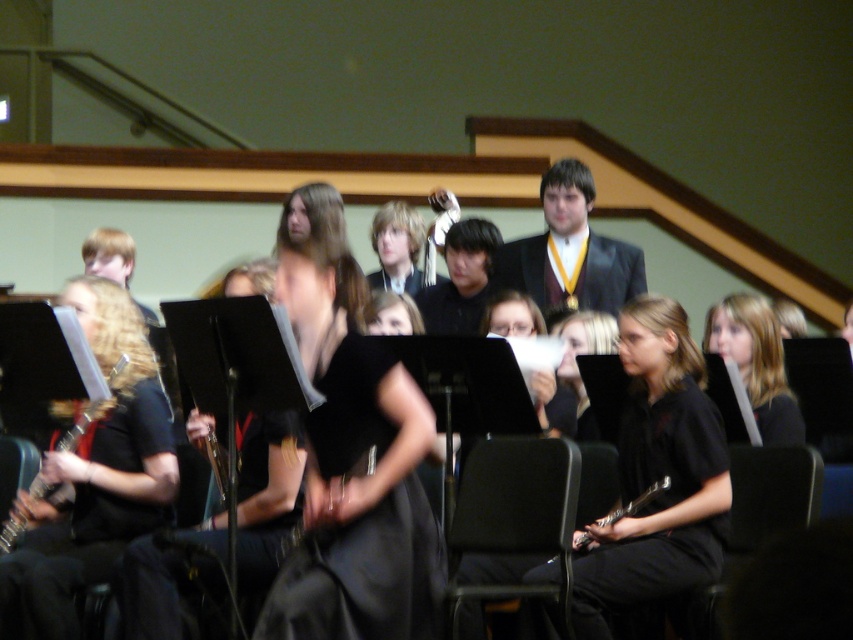
You are a photographer setting up for a school band photo. You need to position a light source between the black fabric hair at right and the wooden saxophone at left. Which object should the light be placed closer to if you want it to be closer to the taller object?

The wooden saxophone at left is taller than the black fabric hair at right. Therefore, the light should be placed closer to the wooden saxophone at left to be near the taller object.

You are a photographer setting up for a school performance. You notice two black dresses at the center of the stage, one labeled as black satin dress at center and the other as black matte dress at center. Which dress is covering part of the other?

The black satin dress at center is positioned over black matte dress at center, so the black satin dress at center is covering part of the black matte dress at center.

Consider the image. You are a photographer in the school auditorium. You need to capture a photo of the black satin dress at center and the black matte dress at center. Which dress will appear larger in the photo?

The black satin dress at center will appear larger in the photo because it is much taller than the black matte dress at center.